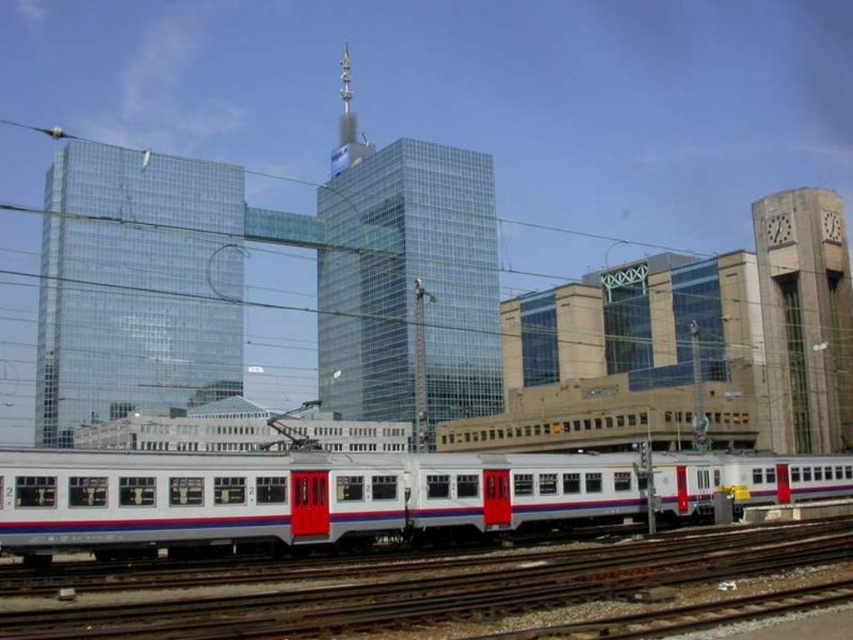
Question: Is white metallic train at lower center to the left of metallic track at lower center from the viewer's perspective?

Choices:
 (A) yes
 (B) no

Answer: (A)

Question: Does white metallic train at lower center have a greater width compared to metallic track at lower center?

Choices:
 (A) yes
 (B) no

Answer: (A)

Question: Can you confirm if white metallic train at lower center is bigger than metallic track at lower center?

Choices:
 (A) no
 (B) yes

Answer: (B)

Question: Which point is farther to the camera?

Choices:
 (A) white metallic train at lower center
 (B) metallic track at lower center

Answer: (A)